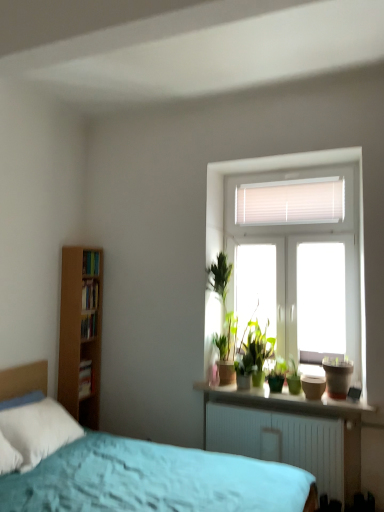
Question: Is hardcover books at left, which is the fourth book from bottom to top, wider or thinner than hardcover book at left, the 3th book positioned from the top?

Choices:
 (A) wide
 (B) thin

Answer: (A)

Question: Is hardcover books at left, which is counted as the 1th book, starting from the top, taller or shorter than hardcover book at left, the 3th book positioned from the top?

Choices:
 (A) tall
 (B) short

Answer: (A)

Question: Which object is the farthest from the matte brown flowerpot at right?

Choices:
 (A) smooth concrete window sill at center
 (B) green matte houseplant at center
 (C) hardcover books at left, which is counted as the 1th book, starting from the top
 (D) hardcover book at left, which appears as the second book when ordered from the bottom
 (E) white paper book at left, the 1th book in the bottom-to-top sequence

Answer: (C)

Question: Which is farther from the smooth concrete window sill at center?

Choices:
 (A) hardcover book at left, which appears as the second book when ordered from the bottom
 (B) wooden bookshelf at left, the third book when ordered from bottom to top
 (C) matte brown flowerpot at right
 (D) white paper book at left, the 4th book positioned from the top
 (E) hardcover books at left, which is the fourth book from bottom to top

Answer: (E)